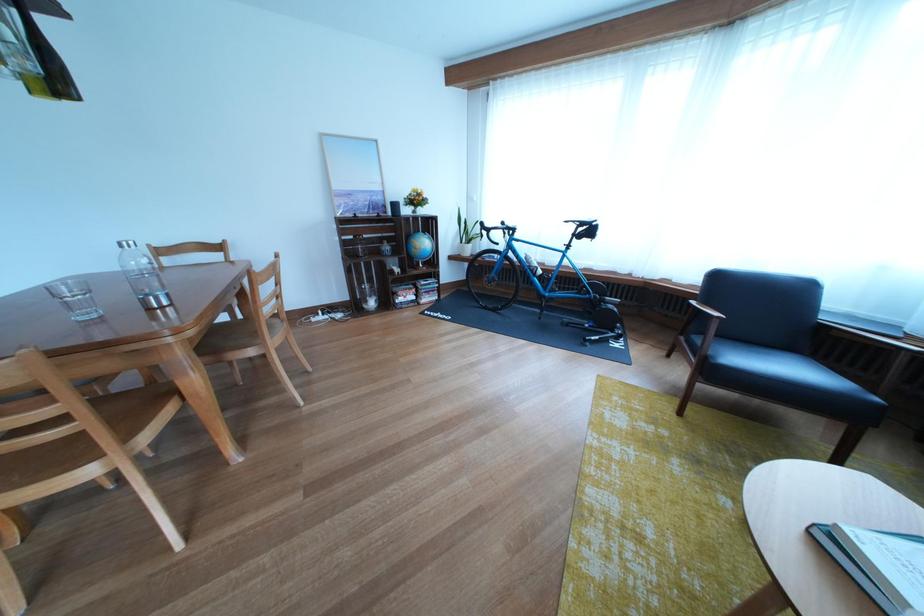
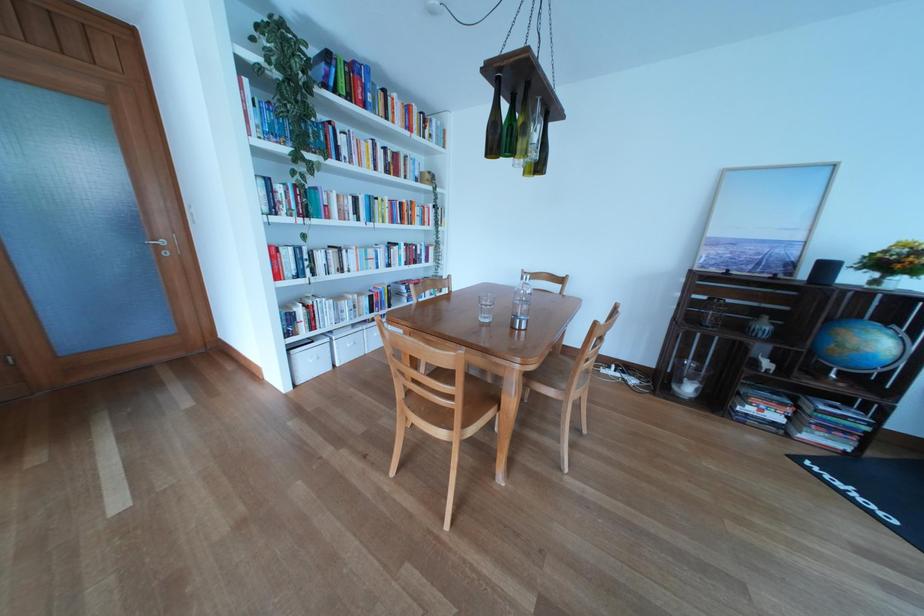
Find the pixel in the second image that matches point 380,307 in the first image.

(694, 389)